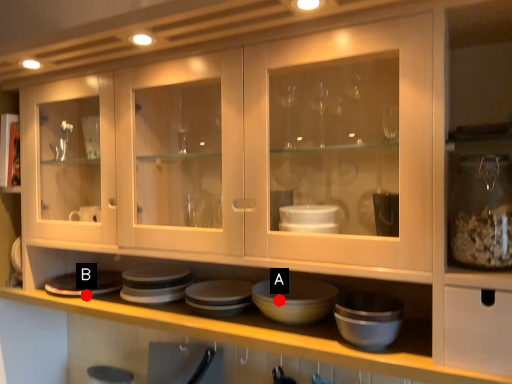
Question: Two points are circled on the image, labeled by A and B beside each circle. Which point is closer to the camera taking this photo?

Choices:
 (A) A is closer
 (B) B is closer

Answer: (A)